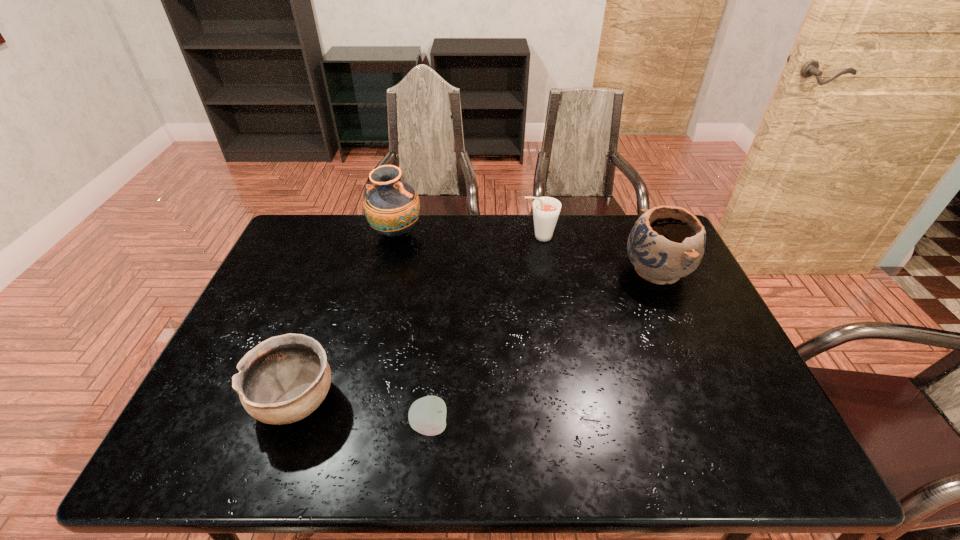
The image size is (960, 540). Identify the location of free point between the second shortest pottery and the fourth tallest object. tap(476, 336).

The width and height of the screenshot is (960, 540). I want to click on unoccupied area between the rightmost pottery and the shortest pottery, so click(476, 336).

Locate an element on the screen. The width and height of the screenshot is (960, 540). free space that is in between the tallest pottery and the rightmost pottery is located at coordinates (526, 252).

Image resolution: width=960 pixels, height=540 pixels. I want to click on unoccupied position between the tallest object and the rightmost object, so click(x=526, y=252).

The height and width of the screenshot is (540, 960). I want to click on empty space that is in between the second object from right to left and the apple, so click(484, 331).

You are a GUI agent. You are given a task and a screenshot of the screen. Output one action in this format:
    pyautogui.click(x=<x>, y=<y>)
    Task: Click on the empty space between the shortest object and the tallest object
    
    Given the screenshot: What is the action you would take?
    pyautogui.click(x=413, y=329)

Where is `object that can be found as the closest to the rightmost pottery`? This screenshot has width=960, height=540. object that can be found as the closest to the rightmost pottery is located at coordinates (546, 210).

Locate which object is the second closest to the nearest pottery. Please provide its 2D coordinates. Your answer should be formatted as a tuple, i.e. [(x, y)], where the tuple contains the x and y coordinates of a point satisfying the conditions above.

[(392, 207)]

Select which pottery is the closest to the shortest pottery. Please provide its 2D coordinates. Your answer should be formatted as a tuple, i.e. [(x, y)], where the tuple contains the x and y coordinates of a point satisfying the conditions above.

[(392, 207)]

Choose which pottery is the third nearest neighbor to the fourth object from left to right. Please provide its 2D coordinates. Your answer should be formatted as a tuple, i.e. [(x, y)], where the tuple contains the x and y coordinates of a point satisfying the conditions above.

[(282, 380)]